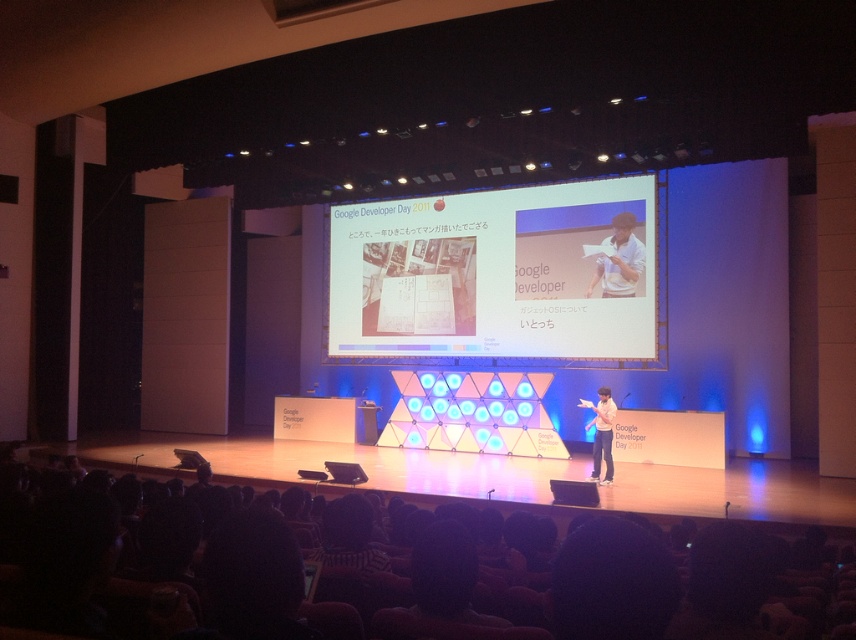
Is black casual wear at center behind matte black laptop at center?

No, it is not.

Can you confirm if black casual wear at center is smaller than matte black laptop at center?

Indeed, black casual wear at center has a smaller size compared to matte black laptop at center.

Between point (218, 486) and point (584, 492), which one is positioned behind?

Point (584, 492)

Find the location of a particular element. The width and height of the screenshot is (856, 640). black casual wear at center is located at coordinates (504, 563).

Between white cotton shirt at center and matte black laptop at center, which one is positioned lower?

matte black laptop at center is lower down.

Is white cotton shirt at center taller than matte black laptop at center?

Yes, white cotton shirt at center is taller than matte black laptop at center.

This screenshot has height=640, width=856. Describe the element at coordinates (619, 259) in the screenshot. I see `white cotton shirt at center` at that location.

You are a GUI agent. You are given a task and a screenshot of the screen. Output one action in this format:
    pyautogui.click(x=<x>, y=<y>)
    Task: Click on the white cotton shirt at center
    The width and height of the screenshot is (856, 640).
    Given the screenshot: What is the action you would take?
    pyautogui.click(x=619, y=259)

Is point (605, 321) closer to camera compared to point (608, 460)?

No.

Based on the photo, does white matte projector screen at center have a greater height compared to white shirt at center?

Incorrect, white matte projector screen at center's height is not larger of white shirt at center's.

Does point (603, 349) lie behind point (610, 433)?

Yes, point (603, 349) is behind point (610, 433).

This screenshot has height=640, width=856. What are the coordinates of `white matte projector screen at center` in the screenshot? It's located at (498, 273).